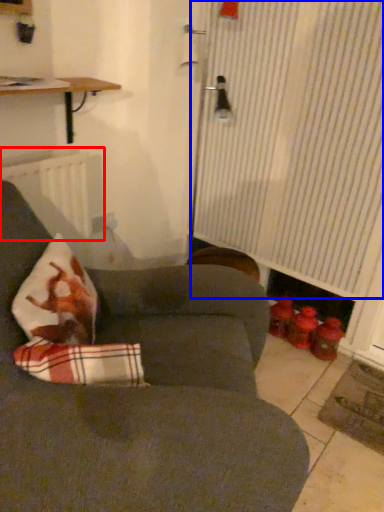
Question: Which object appears closest to the camera in this image, radiator (highlighted by a red box) or curtain (highlighted by a blue box)?

Choices:
 (A) radiator
 (B) curtain

Answer: (B)